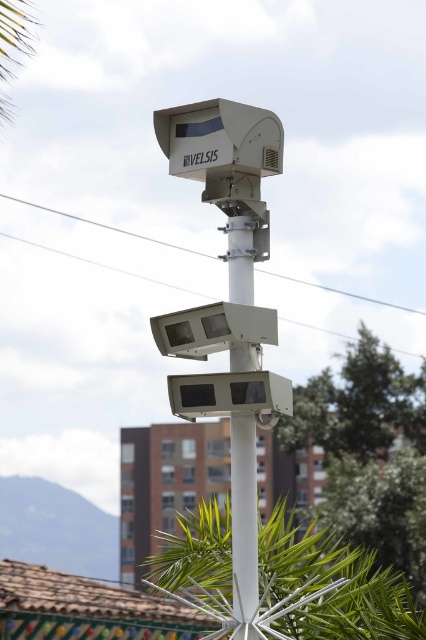
Question: Is the position of green leafy palm tree at lower center less distant than that of green leafy palm tree at upper left?

Choices:
 (A) no
 (B) yes

Answer: (B)

Question: Among these objects, which one is farthest from the camera?

Choices:
 (A) green leafy tree at center
 (B) green leafy palm tree at lower center
 (C) green leafy palm tree at upper left

Answer: (A)

Question: Which object is farther from the camera taking this photo?

Choices:
 (A) green leafy tree at center
 (B) green leafy palm tree at lower center
 (C) green leafy palm tree at upper left
 (D) white matte pole at center

Answer: (A)

Question: Is green leafy palm tree at lower center smaller than green leafy tree at center?

Choices:
 (A) yes
 (B) no

Answer: (A)

Question: Does green leafy palm tree at lower center have a larger size compared to green leafy tree at center?

Choices:
 (A) no
 (B) yes

Answer: (A)

Question: Which point is farther to the camera?

Choices:
 (A) (327, 500)
 (B) (219, 636)
 (C) (241, 218)

Answer: (A)